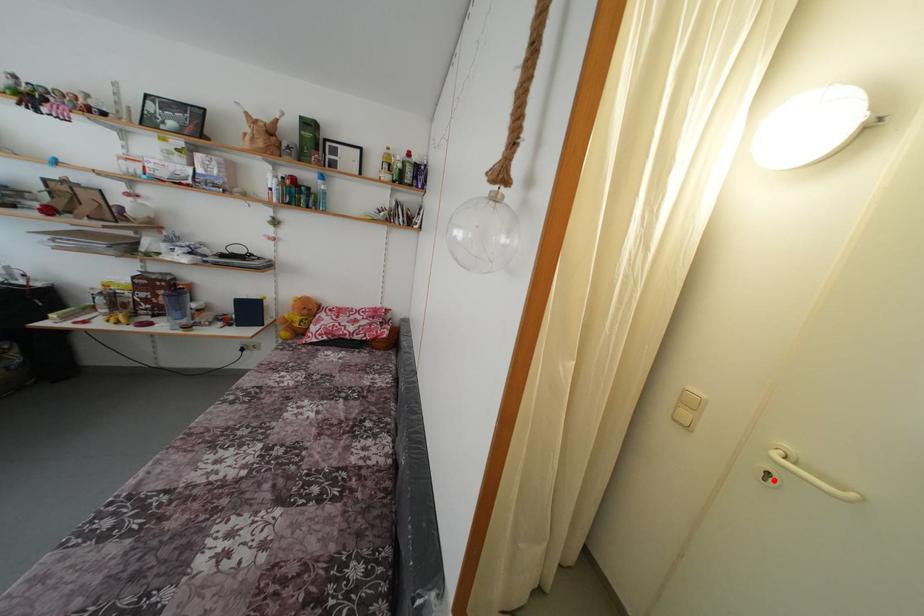
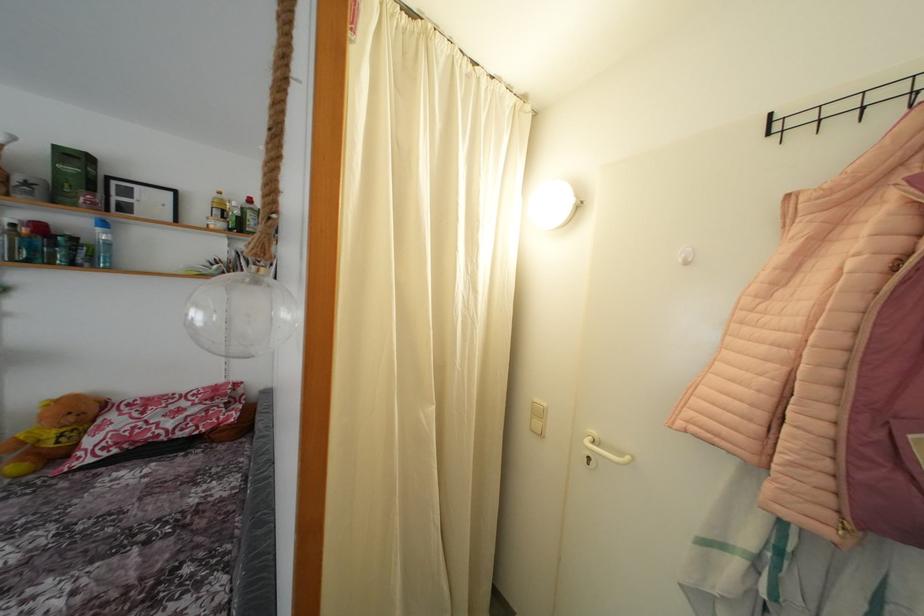
The point at the highlighted location is marked in the first image. Where is the corresponding point in the second image?

(593, 464)